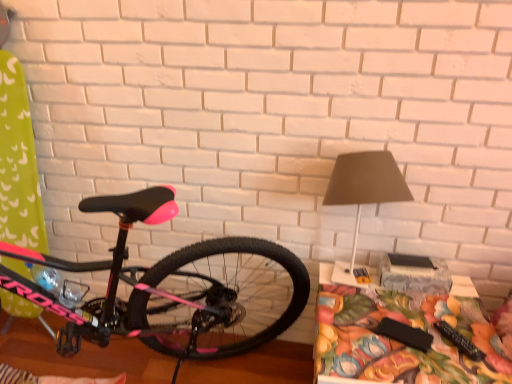
Question: Does matte gray lampshade at upper right turn towards pink matte bicycle at left?

Choices:
 (A) no
 (B) yes

Answer: (A)

Question: Are matte gray lampshade at upper right and pink matte bicycle at left located far from each other?

Choices:
 (A) no
 (B) yes

Answer: (A)

Question: Considering the relative positions of matte gray lampshade at upper right and pink matte bicycle at left in the image provided, is matte gray lampshade at upper right to the right of pink matte bicycle at left from the viewer's perspective?

Choices:
 (A) yes
 (B) no

Answer: (A)

Question: Does matte gray lampshade at upper right have a smaller size compared to pink matte bicycle at left?

Choices:
 (A) yes
 (B) no

Answer: (A)

Question: Considering the relative sizes of matte gray lampshade at upper right and pink matte bicycle at left in the image provided, is matte gray lampshade at upper right taller than pink matte bicycle at left?

Choices:
 (A) yes
 (B) no

Answer: (B)

Question: Is pink matte bicycle at left spatially inside floral fabric table at lower right, or outside of it?

Choices:
 (A) outside
 (B) inside

Answer: (A)

Question: Is pink matte bicycle at left wider or thinner than floral fabric table at lower right?

Choices:
 (A) thin
 (B) wide

Answer: (B)

Question: From the image's perspective, relative to floral fabric table at lower right, is pink matte bicycle at left above or below?

Choices:
 (A) above
 (B) below

Answer: (A)

Question: Considering the relative positions of pink matte bicycle at left and floral fabric table at lower right in the image provided, is pink matte bicycle at left to the left or to the right of floral fabric table at lower right?

Choices:
 (A) right
 (B) left

Answer: (B)

Question: Considering the positions of point (364, 187) and point (407, 347), is point (364, 187) closer or farther from the camera than point (407, 347)?

Choices:
 (A) farther
 (B) closer

Answer: (A)

Question: Visually, is matte gray lampshade at upper right positioned to the left or to the right of floral fabric table at lower right?

Choices:
 (A) right
 (B) left

Answer: (B)

Question: Is matte gray lampshade at upper right in front of or behind floral fabric table at lower right in the image?

Choices:
 (A) behind
 (B) front

Answer: (A)

Question: From the image's perspective, is matte gray lampshade at upper right above or below floral fabric table at lower right?

Choices:
 (A) below
 (B) above

Answer: (B)

Question: Visually, is floral fabric table at lower right positioned to the left or to the right of matte gray lampshade at upper right?

Choices:
 (A) right
 (B) left

Answer: (A)

Question: From a real-world perspective, relative to matte gray lampshade at upper right, is floral fabric table at lower right vertically above or below?

Choices:
 (A) below
 (B) above

Answer: (A)